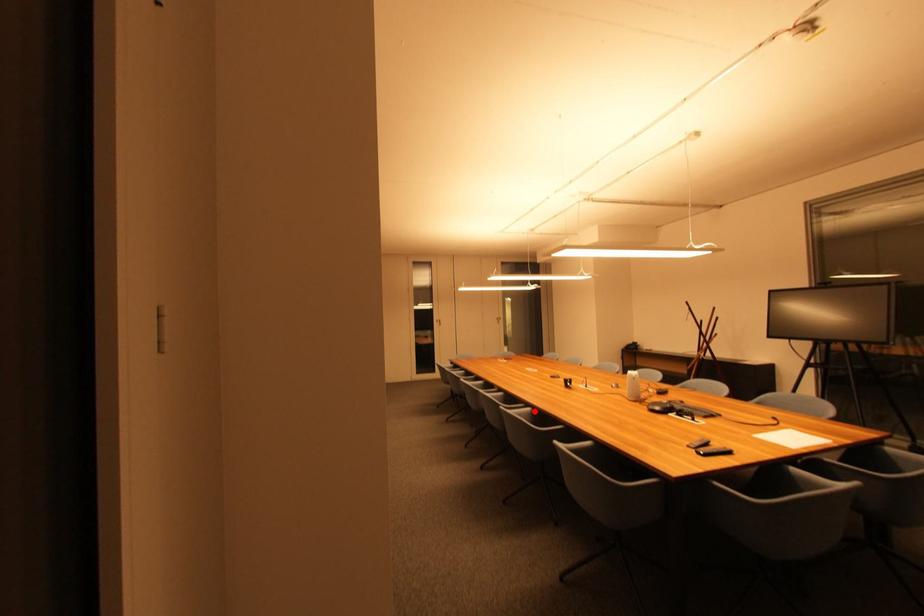
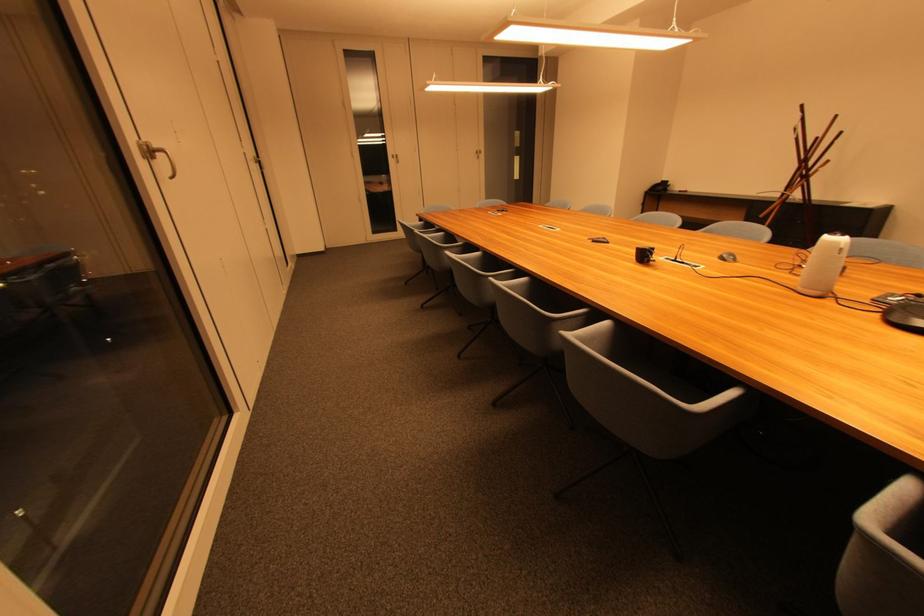
Where in the second image is the point corresponding to the highlighted location from the first image?

(612, 325)